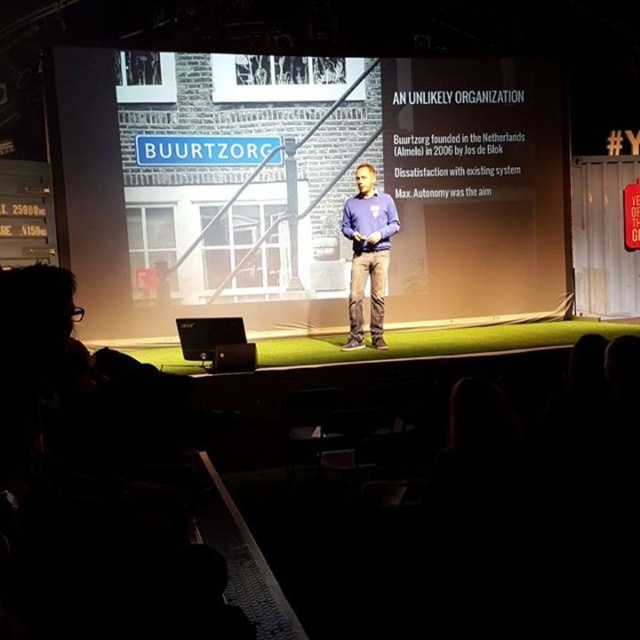
You are a photographer standing at the back of the audience. You want to take a photo of the presenter in the purple sweater at center and the matte black laptop at center. Since you want both subjects to be in focus, you need to know which object is taller. Which one is taller?

The purple sweater at center has a greater height compared to the matte black laptop at center, so you should focus on the purple sweater at center as it is taller.

You are an event planner setting up a stage for a presentation. You have a white matte projection screen at center and a purple sweater at center. Which object is narrower?

The white matte projection screen at center is thinner than the purple sweater at center, so the white matte projection screen at center is narrower.

You are a stagehand preparing to set up a microphone stand. You need to place it between the white matte projection screen at center and the matte black laptop at center so that it is equidistant from both. Is this possible given their current spacing?

The white matte projection screen at center and matte black laptop at center are 3.01 meters apart. To place the microphone stand equidistant between them, it would need to be positioned 1.505 meters from each object. This is possible as the distance allows for such placement.